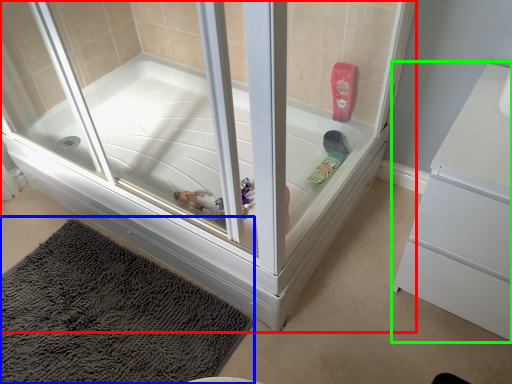
Question: Which object is the farthest from bathtub (highlighted by a red box)? Choose among these: bath mat (highlighted by a blue box) or dresser (highlighted by a green box).

Choices:
 (A) bath mat
 (B) dresser

Answer: (B)